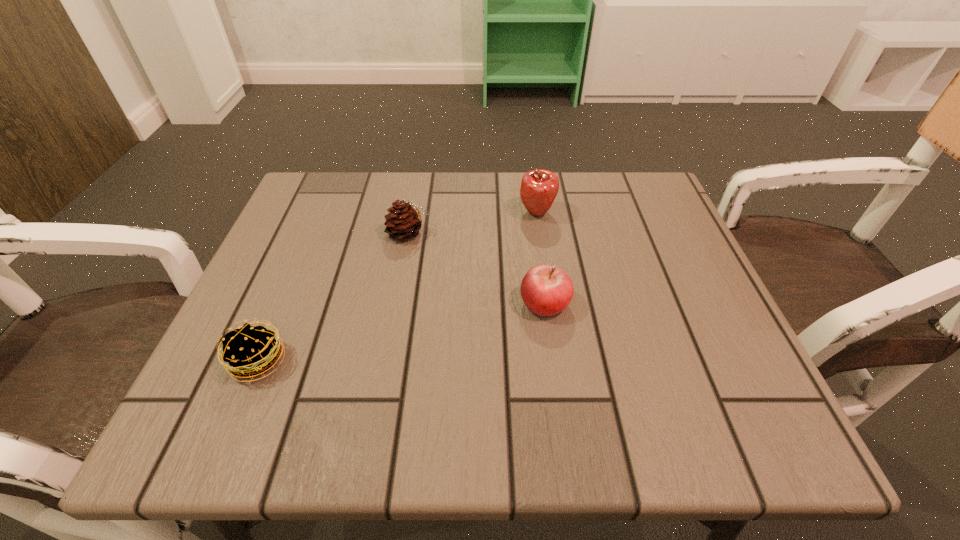
The width and height of the screenshot is (960, 540). Identify the location of empty space that is in between the pinecone and the farther apple. (472, 223).

Identify the location of free space that is in between the second object from left to right and the patty. This screenshot has width=960, height=540. (333, 297).

You are a GUI agent. You are given a task and a screenshot of the screen. Output one action in this format:
    pyautogui.click(x=<x>, y=<y>)
    Task: Click on the object identified as the third closest to the shorter apple
    
    Given the screenshot: What is the action you would take?
    pyautogui.click(x=251, y=350)

This screenshot has height=540, width=960. I want to click on object that is the third closest to the patty, so click(x=539, y=188).

The image size is (960, 540). I want to click on free space that satisfies the following two spatial constraints: 1. with a leaf charm attached to the second object from left to right; 2. on the front side of the shortest object, so click(x=386, y=361).

This screenshot has width=960, height=540. What are the coordinates of `free location that satisfies the following two spatial constraints: 1. with a leaf charm attached to the nearer apple; 2. on the left side of the third object from right to left` in the screenshot? It's located at (396, 303).

The height and width of the screenshot is (540, 960). Identify the location of vacant space that satisfies the following two spatial constraints: 1. on the back side of the third farthest object; 2. with a leaf charm attached to the pinecone. 535,233.

Where is `vacant space that satisfies the following two spatial constraints: 1. with a leaf charm attached to the second object from left to right; 2. on the front side of the patty`? The width and height of the screenshot is (960, 540). vacant space that satisfies the following two spatial constraints: 1. with a leaf charm attached to the second object from left to right; 2. on the front side of the patty is located at coordinates (386, 361).

Find the location of `free region that satisfies the following two spatial constraints: 1. on the back side of the taller apple; 2. on the left side of the nearest object`. free region that satisfies the following two spatial constraints: 1. on the back side of the taller apple; 2. on the left side of the nearest object is located at coordinates (321, 213).

The width and height of the screenshot is (960, 540). I want to click on blank area in the image that satisfies the following two spatial constraints: 1. on the back side of the taller apple; 2. on the right side of the nearer apple, so click(x=533, y=213).